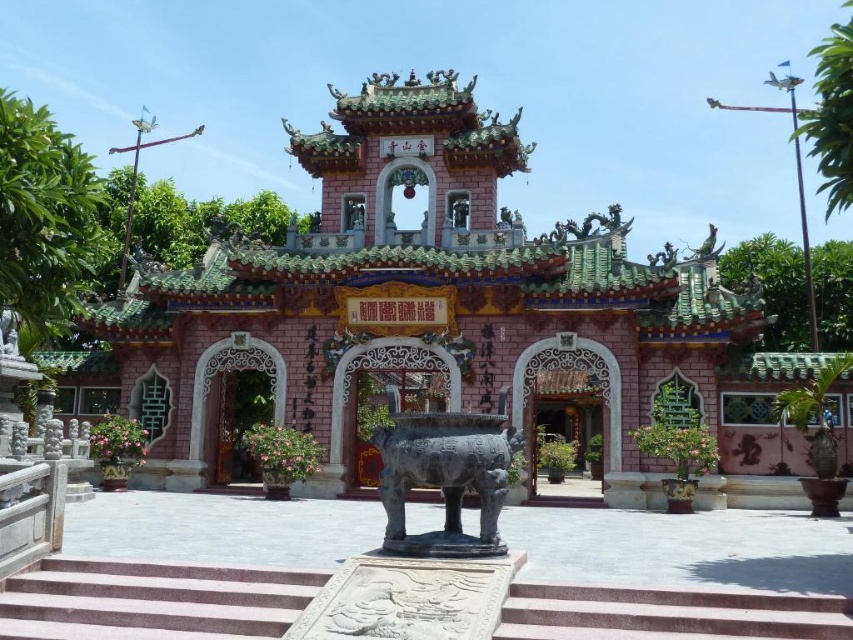
Describe the element at coordinates (151, 600) in the screenshot. The height and width of the screenshot is (640, 853). I see `pink marble stairs at center` at that location.

Measure the distance between pink marble stairs at center and black polished bronze statue at center.

They are 17.71 feet apart.

Find the location of a particular element. The height and width of the screenshot is (640, 853). pink marble stairs at center is located at coordinates (151, 600).

Where is `pink marble stairs at center`? The image size is (853, 640). pink marble stairs at center is located at coordinates pos(151,600).

Does pink stone palace at center appear on the right side of pink marble stairs at center?

Yes, pink stone palace at center is to the right of pink marble stairs at center.

Consider the image. Is pink stone palace at center positioned before pink marble stairs at center?

No, pink stone palace at center is further to the viewer.

Is point (357, 244) more distant than point (270, 637)?

Yes, point (357, 244) is behind point (270, 637).

At what (x,y) coordinates should I click in order to perform the action: click on pink stone palace at center. Please return your answer as a coordinate pair (x, y). This screenshot has width=853, height=640. Looking at the image, I should click on (442, 314).

Image resolution: width=853 pixels, height=640 pixels. Describe the element at coordinates (445, 477) in the screenshot. I see `black polished bronze statue at center` at that location.

Between black polished bronze statue at center and pink stone archway at center, which one has less height?

With less height is black polished bronze statue at center.

Does point (457, 483) come closer to viewer compared to point (570, 408)?

Yes, point (457, 483) is in front of point (570, 408).

At what (x,y) coordinates should I click in order to perform the action: click on black polished bronze statue at center. Please return your answer as a coordinate pair (x, y). Looking at the image, I should click on (445, 477).